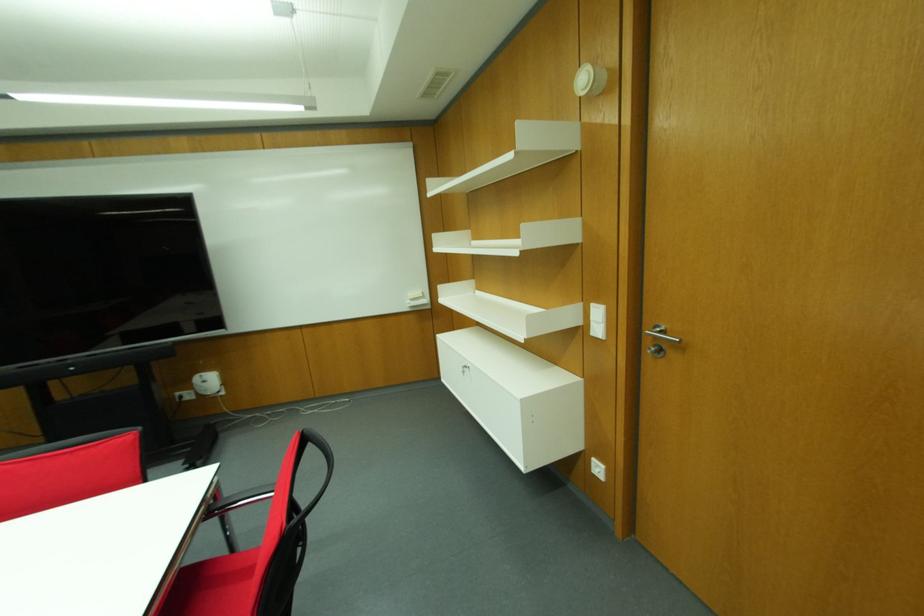
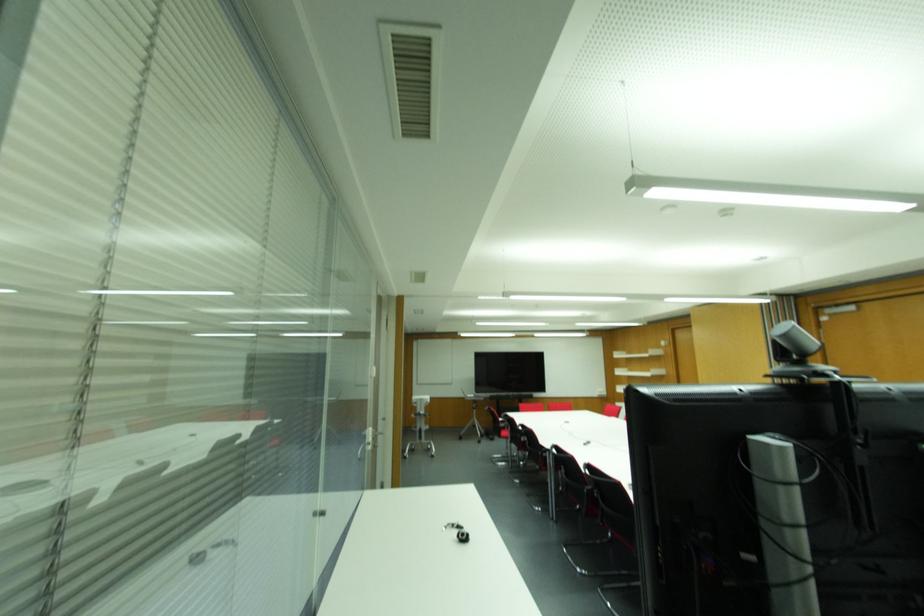
Where in the second image is the point corresponding to (x=214, y=321) from the first image?

(541, 389)